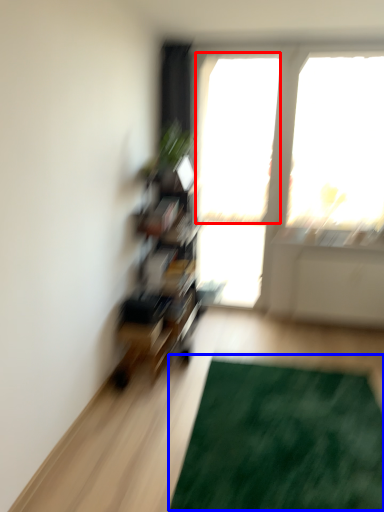
Question: Which object appears farthest to the camera in this image, window screen (highlighted by a red box) or doormat (highlighted by a blue box)?

Choices:
 (A) window screen
 (B) doormat

Answer: (A)